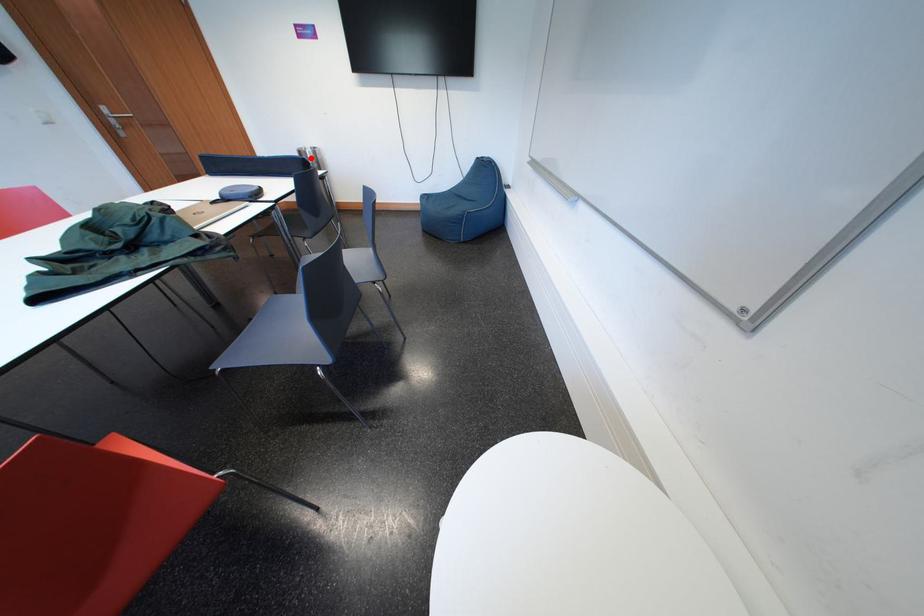
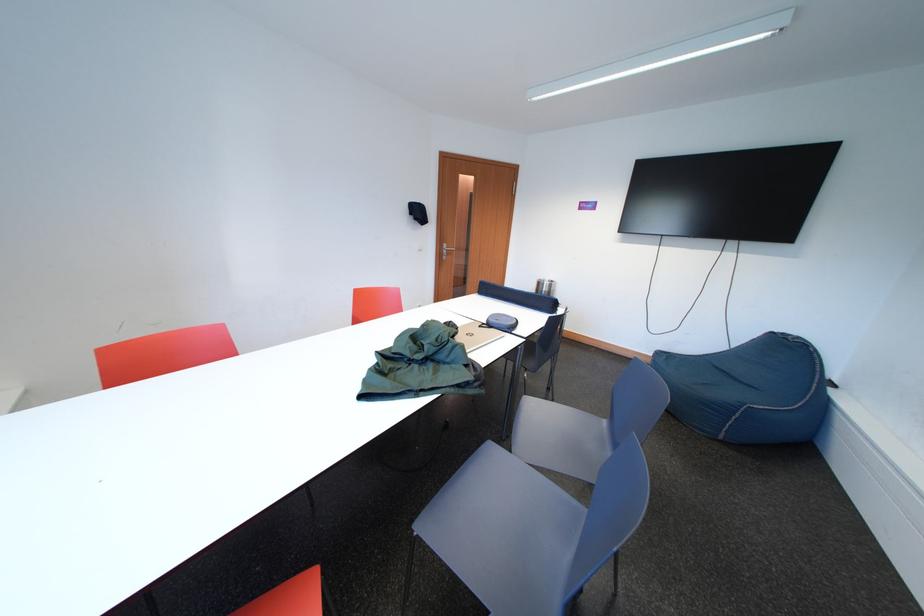
Question: A red point is marked in image1. In image2, is the corresponding 3D point closer to the camera or farther? Reply with the corresponding letter.

Choices:
 (A) The corresponding 3D point is closer.
 (B) The corresponding 3D point is farther.

Answer: (A)